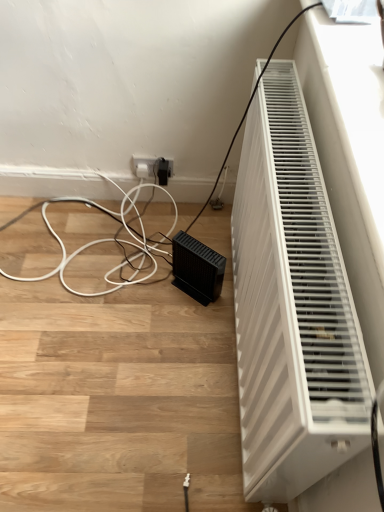
Where is `empty space that is in between black matte speaker at lower center and white plastic radiator at right`? The height and width of the screenshot is (512, 384). empty space that is in between black matte speaker at lower center and white plastic radiator at right is located at coordinates coord(208,366).